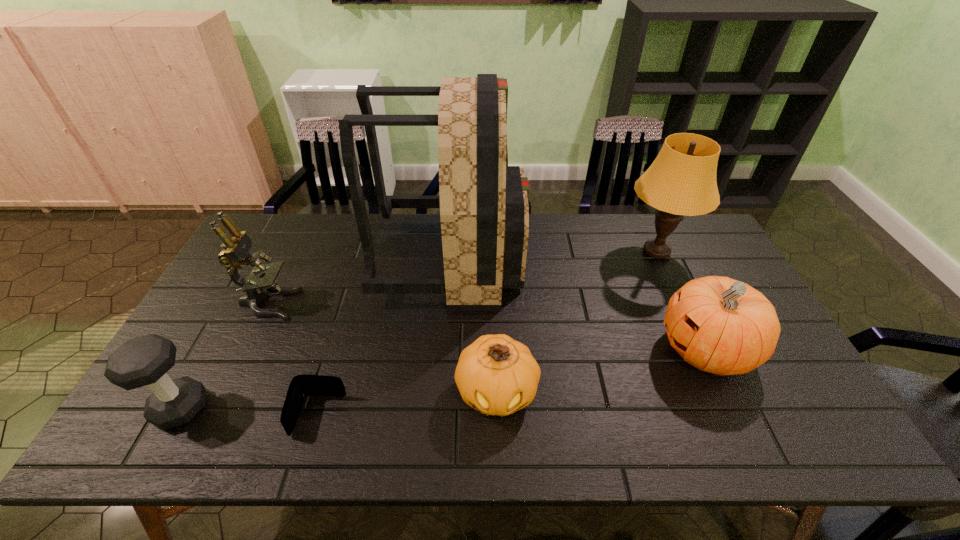
What are the coordinates of `free space located on the front-facing side of the taller pumpkin` in the screenshot? It's located at (594, 349).

Locate an element on the screen. This screenshot has height=540, width=960. vacant space located 0.310m on the front-facing side of the taller pumpkin is located at coordinates (542, 349).

The image size is (960, 540). Identify the location of vacant area located on the front-facing side of the taller pumpkin. (639, 349).

The width and height of the screenshot is (960, 540). Identify the location of vacant space located on the right of the dumbbell. (245, 408).

The image size is (960, 540). I want to click on backpack present at the far edge, so click(484, 211).

Where is `lampshade positioned at the far edge`? Image resolution: width=960 pixels, height=540 pixels. lampshade positioned at the far edge is located at coordinates (681, 181).

Identify the location of dumbbell located in the near edge section of the desktop. This screenshot has height=540, width=960. (141, 361).

Image resolution: width=960 pixels, height=540 pixels. What are the coordinates of `pumpkin situated at the near edge` in the screenshot? It's located at (496, 375).

Find the location of a particular element. wallet located in the near edge section of the desktop is located at coordinates (303, 385).

Locate an element on the screen. microscope located in the left edge section of the desktop is located at coordinates (235, 253).